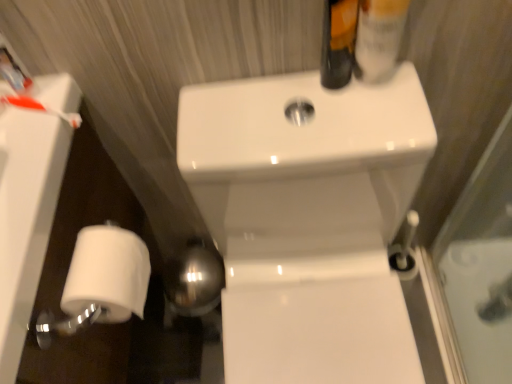
Find the location of a particular element. This screenshot has height=384, width=512. vacant area situated to the left side of matte black bottle at upper right is located at coordinates (254, 105).